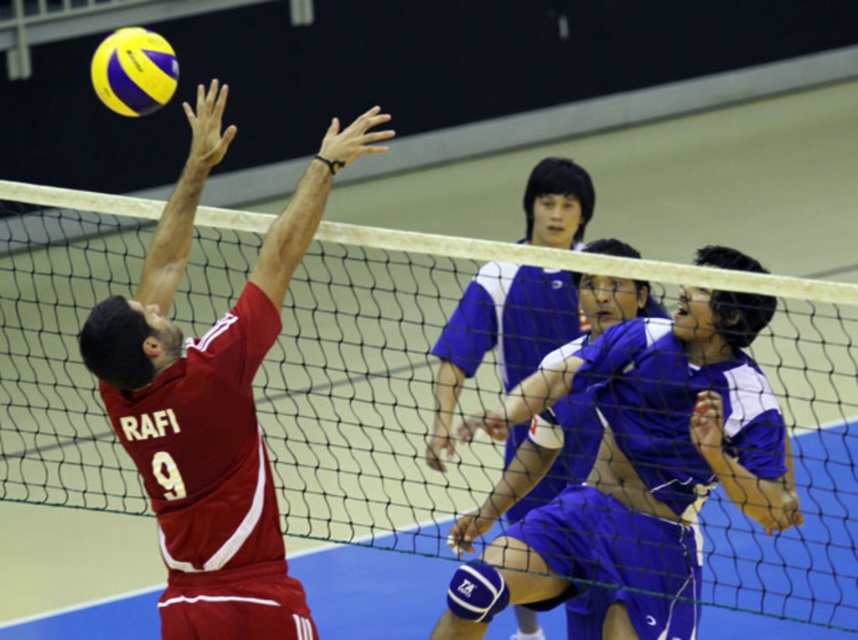
Question: Which object is the farthest from the matte red jersey at upper left?

Choices:
 (A) blue jersey at center
 (B) yellow matte volleyball at upper left

Answer: (A)

Question: Can you confirm if white mesh net at center is positioned to the right of matte red jersey at upper left?

Choices:
 (A) no
 (B) yes

Answer: (A)

Question: From the image, what is the correct spatial relationship of white mesh net at center in relation to matte red jersey at upper left?

Choices:
 (A) below
 (B) above

Answer: (B)

Question: Considering the real-world distances, which object is closest to the matte red jersey at upper left?

Choices:
 (A) yellow matte volleyball at upper left
 (B) blue jersey at center
 (C) white mesh net at center

Answer: (A)

Question: Estimate the real-world distances between objects in this image. Which object is closer to the white mesh net at center?

Choices:
 (A) matte red jersey at upper left
 (B) blue jersey at center

Answer: (A)

Question: Is white mesh net at center to the right of matte red jersey at upper left from the viewer's perspective?

Choices:
 (A) yes
 (B) no

Answer: (B)